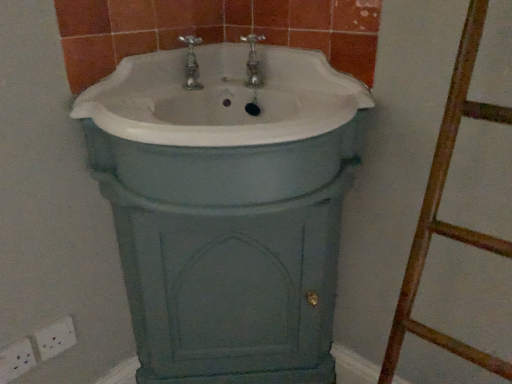
Question: Is white plastic electric outlet at lower left, the 1th electric outlet when ordered from right to left, positioned with its back to white ceramic sink at center?

Choices:
 (A) yes
 (B) no

Answer: (B)

Question: Is white plastic electric outlet at lower left, marked as the 2th electric outlet in a left-to-right arrangement, next to white ceramic sink at center?

Choices:
 (A) no
 (B) yes

Answer: (A)

Question: Is white plastic electric outlet at lower left, the 1th electric outlet when ordered from right to left, surrounding white ceramic sink at center?

Choices:
 (A) no
 (B) yes

Answer: (A)

Question: From a real-world perspective, does white plastic electric outlet at lower left, the 1th electric outlet when ordered from right to left, sit lower than white ceramic sink at center?

Choices:
 (A) no
 (B) yes

Answer: (B)

Question: Is white plastic electric outlet at lower left, marked as the 2th electric outlet in a left-to-right arrangement, smaller than white ceramic sink at center?

Choices:
 (A) yes
 (B) no

Answer: (A)

Question: From the image's perspective, does white plastic electric outlet at lower left, marked as the 2th electric outlet in a left-to-right arrangement, appear higher than white ceramic sink at center?

Choices:
 (A) no
 (B) yes

Answer: (A)

Question: Does white ceramic sink at center have a greater width compared to white plastic electric outlet at lower left, which is the 2th electric outlet from right to left?

Choices:
 (A) no
 (B) yes

Answer: (B)

Question: From the image's perspective, is white ceramic sink at center beneath white plastic electric outlet at lower left, which is the 1th electric outlet in left-to-right order?

Choices:
 (A) no
 (B) yes

Answer: (A)

Question: Considering the relative positions of white ceramic sink at center and white plastic electric outlet at lower left, which is the 2th electric outlet from right to left, in the image provided, is white ceramic sink at center to the right of white plastic electric outlet at lower left, which is the 2th electric outlet from right to left, from the viewer's perspective?

Choices:
 (A) yes
 (B) no

Answer: (A)

Question: Is white ceramic sink at center aimed at white plastic electric outlet at lower left, which is the 1th electric outlet in left-to-right order?

Choices:
 (A) yes
 (B) no

Answer: (A)

Question: Is white ceramic sink at center thinner than white plastic electric outlet at lower left, which is the 2th electric outlet from right to left?

Choices:
 (A) yes
 (B) no

Answer: (B)

Question: From the image's perspective, is white ceramic sink at center located above white plastic electric outlet at lower left, which is the 2th electric outlet from right to left?

Choices:
 (A) no
 (B) yes

Answer: (B)

Question: Considering the relative sizes of white plastic electric outlet at lower left, which is the 1th electric outlet in left-to-right order, and white plastic electric outlet at lower left, the 1th electric outlet when ordered from right to left, in the image provided, is white plastic electric outlet at lower left, which is the 1th electric outlet in left-to-right order, shorter than white plastic electric outlet at lower left, the 1th electric outlet when ordered from right to left,?

Choices:
 (A) no
 (B) yes

Answer: (B)